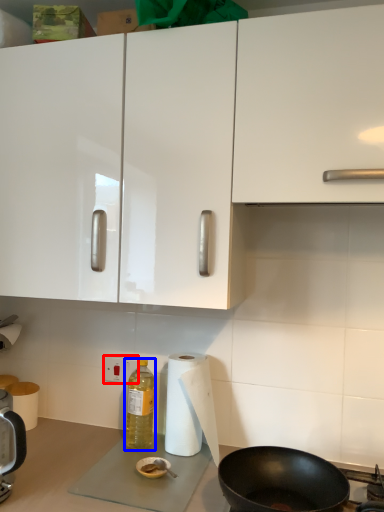
Question: Which object appears farthest to the camera in this image, electric outlet (highlighted by a red box) or bottle (highlighted by a blue box)?

Choices:
 (A) electric outlet
 (B) bottle

Answer: (A)